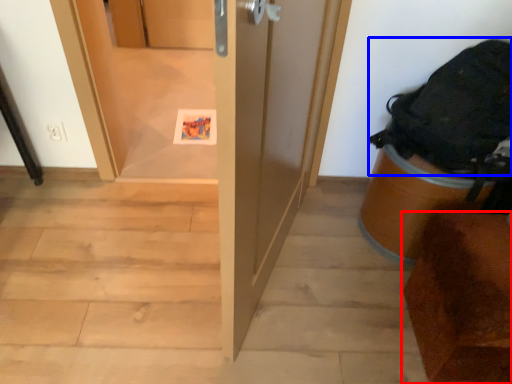
Question: Which point is further to the camera, furniture (highlighted by a red box) or backpack (highlighted by a blue box)?

Choices:
 (A) furniture
 (B) backpack

Answer: (B)